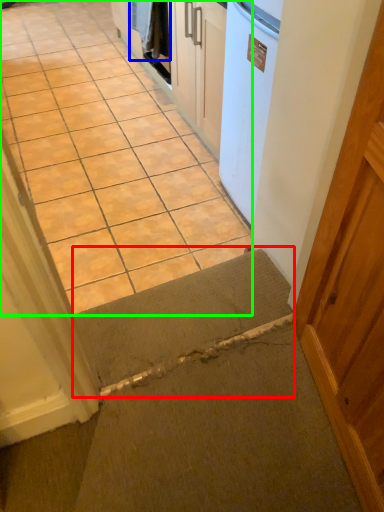
Question: Which object is positioned closest to doormat (highlighted by a red box)? Select from laundry (highlighted by a blue box) and concrete (highlighted by a green box).

Choices:
 (A) laundry
 (B) concrete

Answer: (B)